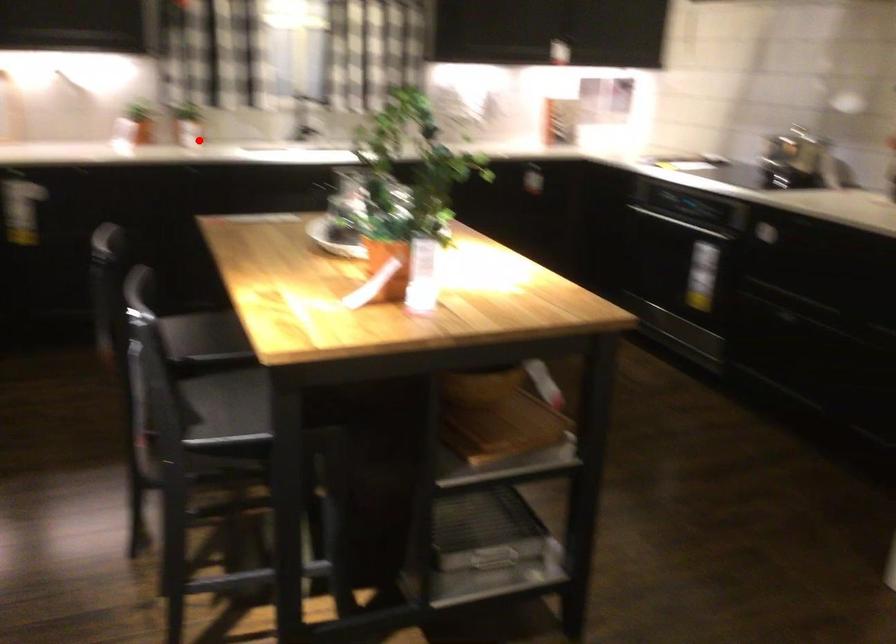
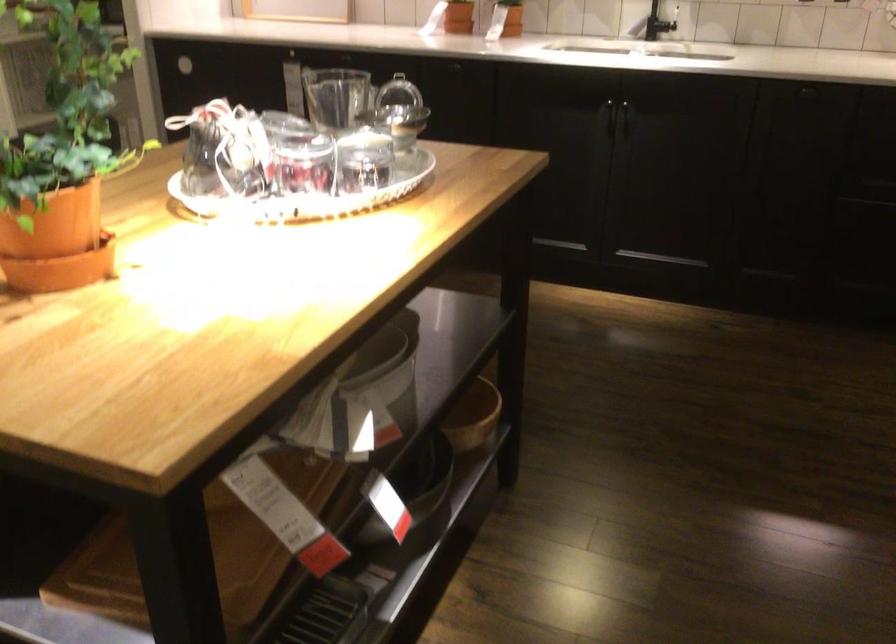
Question: I am providing you with two images of the same scene from different viewpoints. A red point is shown in image1. For the corresponding object point in image2, is it positioned nearer or farther from the camera?

Choices:
 (A) Nearer
 (B) Farther

Answer: (A)